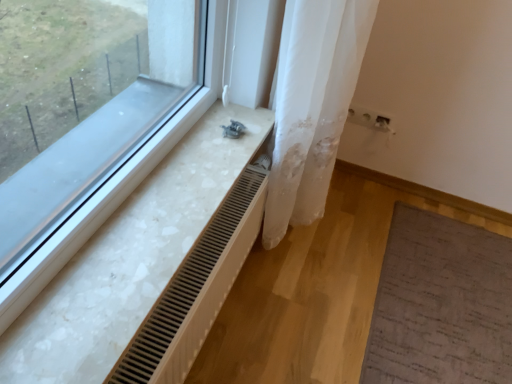
Find the location of a particular element. The height and width of the screenshot is (384, 512). free space above white marble radiator at lower left (from a real-world perspective) is located at coordinates (164, 199).